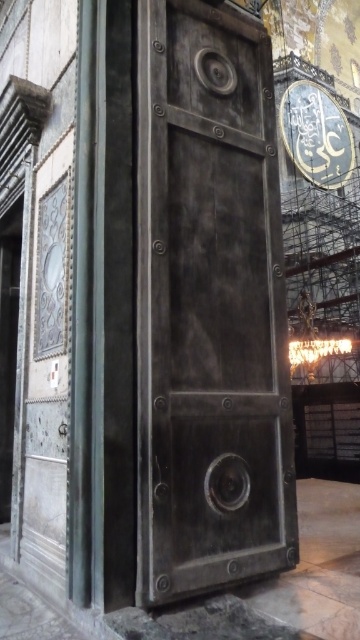
Question: Does rusty metal door at center come behind shiny metallic clock at center?

Choices:
 (A) no
 (B) yes

Answer: (A)

Question: Which point appears farthest from the camera in this image?

Choices:
 (A) (255, 428)
 (B) (344, 148)

Answer: (B)

Question: Which object is closer to the camera taking this photo?

Choices:
 (A) rusty metal door at center
 (B) shiny metallic clock at center

Answer: (A)

Question: Does rusty metal door at center have a smaller size compared to shiny metallic clock at center?

Choices:
 (A) yes
 (B) no

Answer: (A)

Question: Which of the following is the closest to the observer?

Choices:
 (A) shiny metallic clock at center
 (B) rusty metal door at center

Answer: (B)

Question: Can you confirm if rusty metal door at center is wider than shiny metallic clock at center?

Choices:
 (A) no
 (B) yes

Answer: (A)